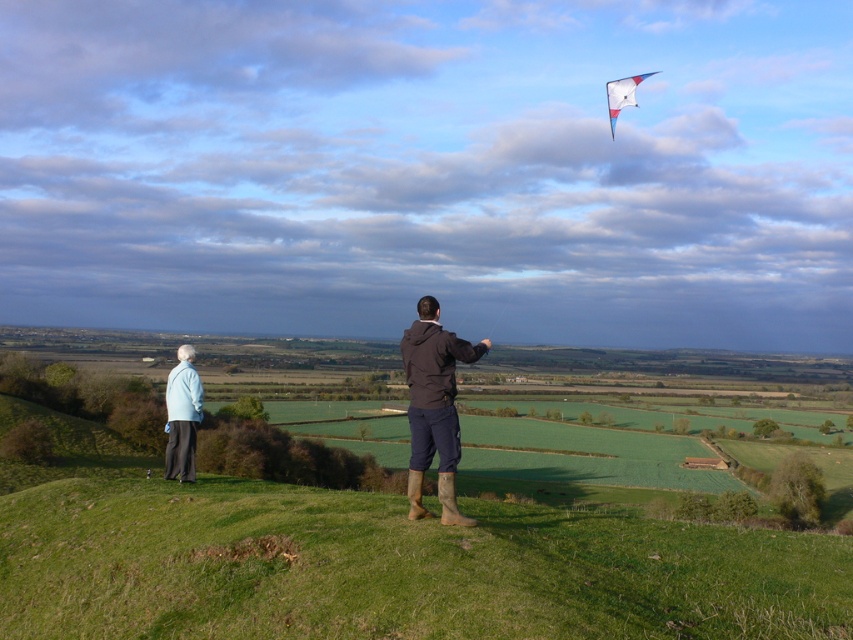
You are a photographer trying to capture both the light blue fabric jacket at lower left and the white glossy kite at upper right in the same frame. Which object should you focus on first to ensure both are in focus, considering their sizes and positions?

The light blue fabric jacket at lower left has a smaller size compared to the white glossy kite at upper right. To ensure both are in focus, you should focus on the smaller object first, which is the light blue fabric jacket at lower left, as it requires more precise focus due to its smaller size and closer proximity.

You are a photographer trying to capture a photo of the two people in the scene. You notice the brown suede boots at lower center and the light blue fabric jacket at lower left. Which object should you focus on first if you want to ensure both are in focus, considering their heights?

The brown suede boots at lower center has a lesser height compared to light blue fabric jacket at lower left. Therefore, you should focus on the light blue fabric jacket at lower left first since it is taller and will require adjusting the camera to capture both objects properly.